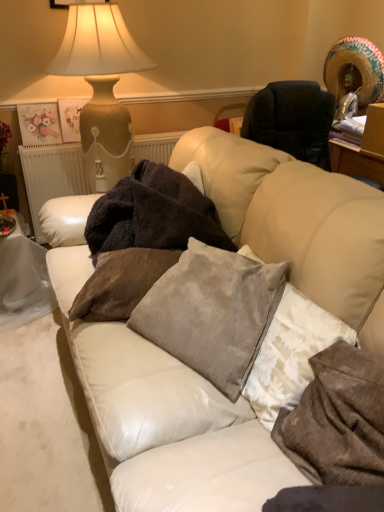
Question: Can you confirm if wooden picture frame at upper center is bigger than velvet brown pillow at center, the first pillow positioned from the left?

Choices:
 (A) no
 (B) yes

Answer: (A)

Question: From the image's perspective, is wooden picture frame at upper center over velvet brown pillow at center, the first pillow positioned from the left?

Choices:
 (A) yes
 (B) no

Answer: (A)

Question: From a real-world perspective, is wooden picture frame at upper center over velvet brown pillow at center, the first pillow positioned from the left?

Choices:
 (A) no
 (B) yes

Answer: (B)

Question: Is wooden picture frame at upper center directly adjacent to velvet brown pillow at center, the first pillow positioned from the left?

Choices:
 (A) yes
 (B) no

Answer: (B)

Question: Could you tell me if wooden picture frame at upper center is facing velvet brown pillow at center, the third pillow from the right?

Choices:
 (A) no
 (B) yes

Answer: (A)

Question: Considering the relative sizes of wooden picture frame at upper center and velvet brown pillow at center, the first pillow positioned from the left, in the image provided, is wooden picture frame at upper center shorter than velvet brown pillow at center, the first pillow positioned from the left,?

Choices:
 (A) no
 (B) yes

Answer: (A)

Question: Is matte beige ceramic table lamp at upper left positioned beyond the bounds of multicolored woven straw hat at upper right?

Choices:
 (A) yes
 (B) no

Answer: (A)

Question: Is multicolored woven straw hat at upper right located within matte beige ceramic table lamp at upper left?

Choices:
 (A) no
 (B) yes

Answer: (A)

Question: From the image's perspective, is matte beige ceramic table lamp at upper left below multicolored woven straw hat at upper right?

Choices:
 (A) no
 (B) yes

Answer: (B)

Question: Is matte beige ceramic table lamp at upper left smaller than multicolored woven straw hat at upper right?

Choices:
 (A) no
 (B) yes

Answer: (A)

Question: Considering the relative sizes of matte beige ceramic table lamp at upper left and multicolored woven straw hat at upper right in the image provided, is matte beige ceramic table lamp at upper left bigger than multicolored woven straw hat at upper right?

Choices:
 (A) yes
 (B) no

Answer: (A)

Question: Can you confirm if matte beige ceramic table lamp at upper left is taller than multicolored woven straw hat at upper right?

Choices:
 (A) yes
 (B) no

Answer: (A)

Question: Is velvet gray pillow at center, arranged as the second pillow when viewed from the right, taller than velvet brown pillow at center, the first pillow positioned from the left?

Choices:
 (A) yes
 (B) no

Answer: (A)